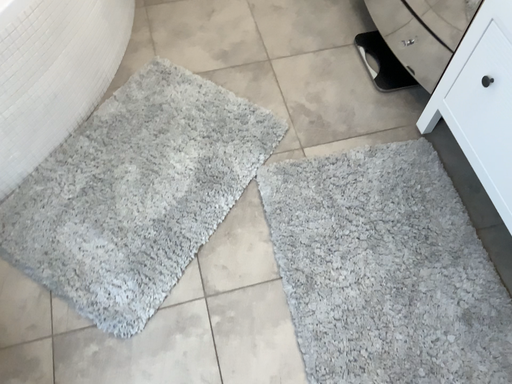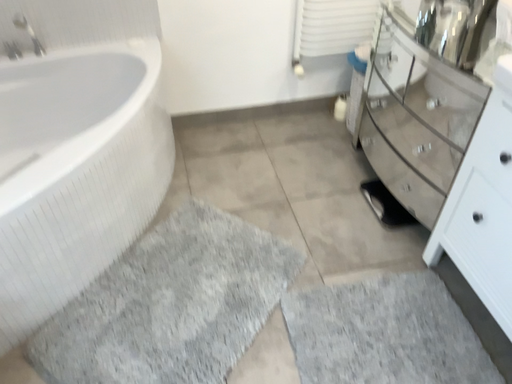
Question: How did the camera likely rotate when shooting the video?

Choices:
 (A) rotated upward
 (B) rotated downward

Answer: (A)